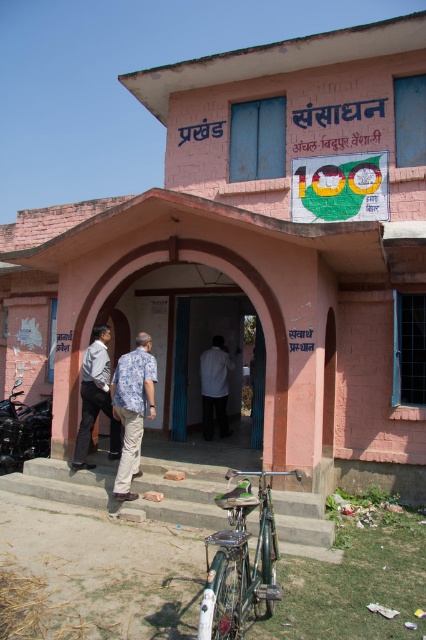
Question: Which object is positioned farthest from the shiny black motorcycle at lower left?

Choices:
 (A) blue floral shirt at center
 (B) white fabric shirt at center

Answer: (B)

Question: Is light blue shirt at center above white fabric shirt at center?

Choices:
 (A) yes
 (B) no

Answer: (A)

Question: Does light blue shirt at center appear on the right side of white fabric shirt at center?

Choices:
 (A) yes
 (B) no

Answer: (B)

Question: Can you confirm if blue floral shirt at center is thinner than light blue shirt at center?

Choices:
 (A) yes
 (B) no

Answer: (A)

Question: Which of the following is the farthest from the observer?

Choices:
 (A) (80, 426)
 (B) (14, 410)
 (C) (126, 392)
 (D) (222, 371)

Answer: (D)

Question: Estimate the real-world distances between objects in this image. Which object is farther from the blue floral shirt at center?

Choices:
 (A) white fabric shirt at center
 (B) light blue shirt at center
 (C) shiny black motorcycle at lower left

Answer: (A)